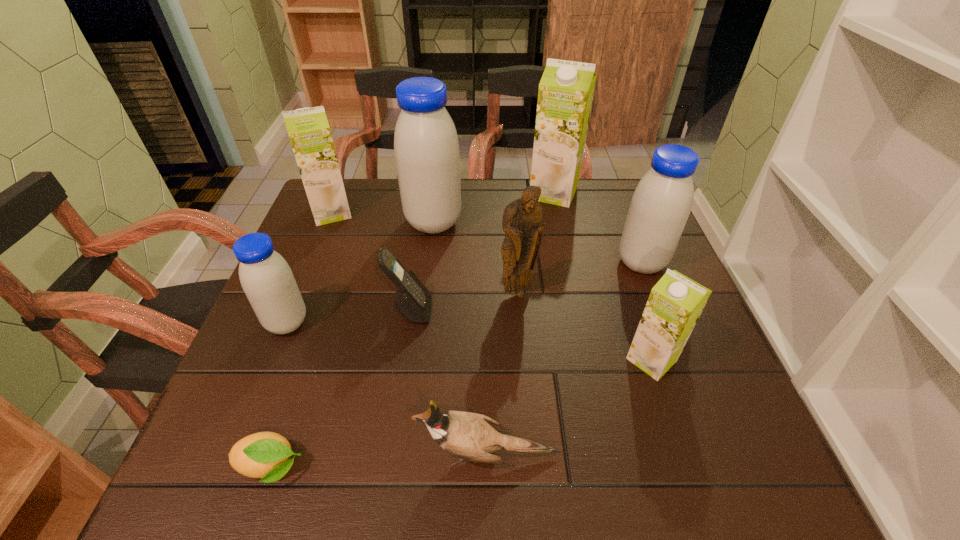
Identify which blue soya milk is located as the nearest to the nearest green soya milk. Please provide its 2D coordinates. Your answer should be formatted as a tuple, i.e. [(x, y)], where the tuple contains the x and y coordinates of a point satisfying the conditions above.

[(662, 201)]

Locate which blue soya milk ranks in proximity to the cellular telephone. Please provide its 2D coordinates. Your answer should be formatted as a tuple, i.e. [(x, y)], where the tuple contains the x and y coordinates of a point satisfying the conditions above.

[(266, 278)]

Where is `free region that satisfies the following two spatial constraints: 1. on the front side of the smallest green soya milk; 2. at the face of the bird`? free region that satisfies the following two spatial constraints: 1. on the front side of the smallest green soya milk; 2. at the face of the bird is located at coordinates (684, 454).